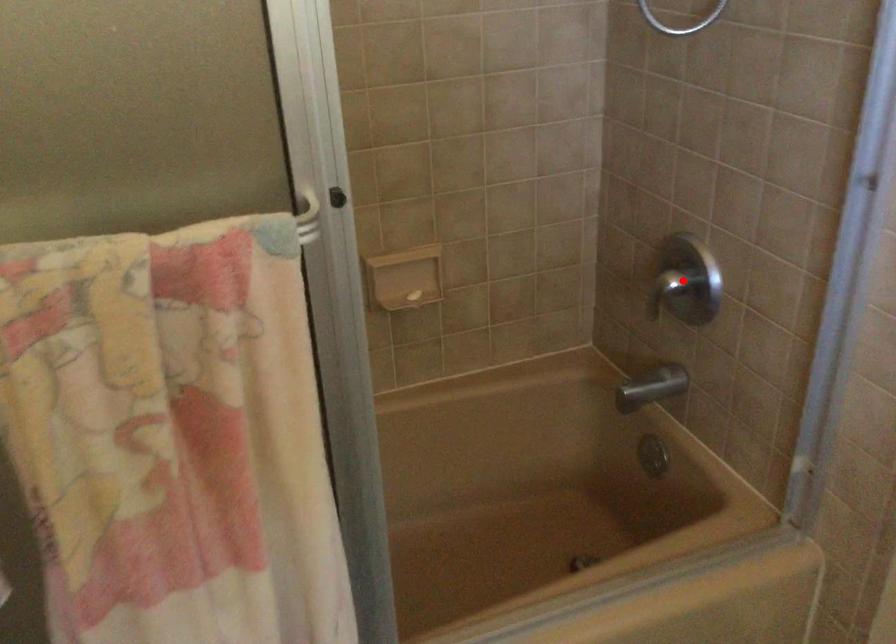
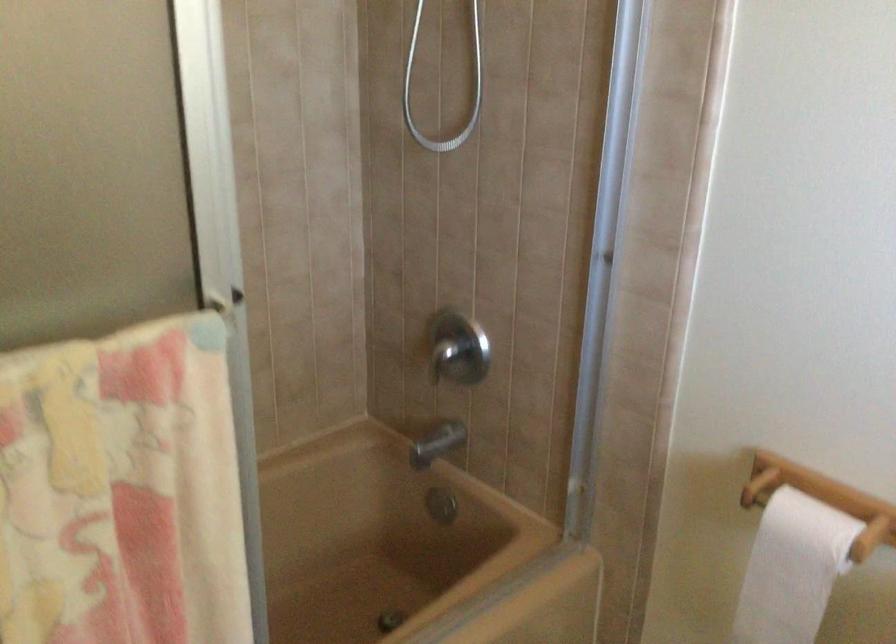
Question: I am providing you with two images of the same scene from different viewpoints. A red point is shown in image1. For the corresponding object point in image2, is it positioned nearer or farther from the camera?

Choices:
 (A) Nearer
 (B) Farther

Answer: (B)